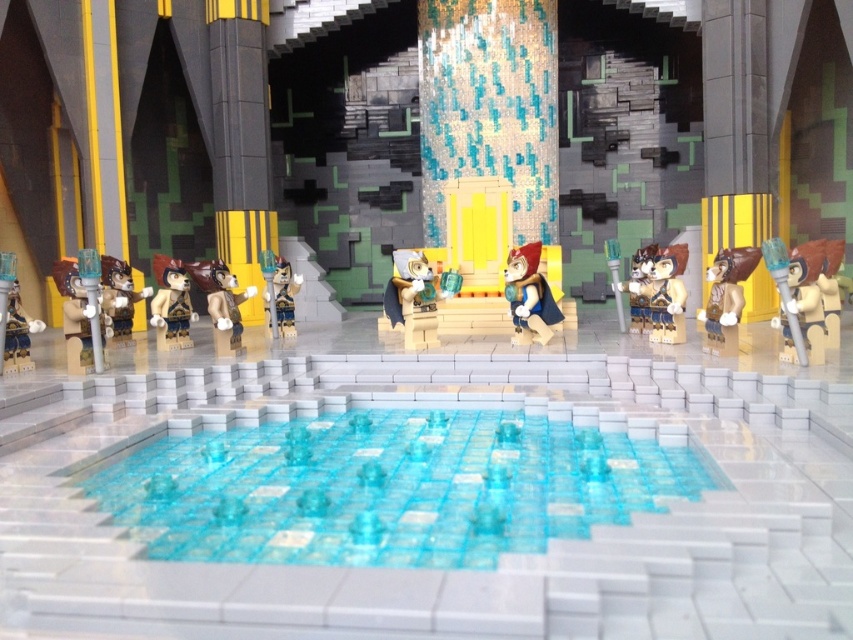
You are a visitor observing the Lego scene and want to take a photo of the brown matte figure at left and the matte brown minifigure at left. Which one will appear closer to you in the photo?

The brown matte figure at left will appear closer to you in the photo because it is positioned further to the viewer than the matte brown minifigure at left.

In the Lego fantasy scene, there is a matte gray fur at center and a matte brown minifigure at left. Which object has a smaller width?

The matte gray fur at center is thinner than the matte brown minifigure at left, so the matte gray fur at center has a smaller width.